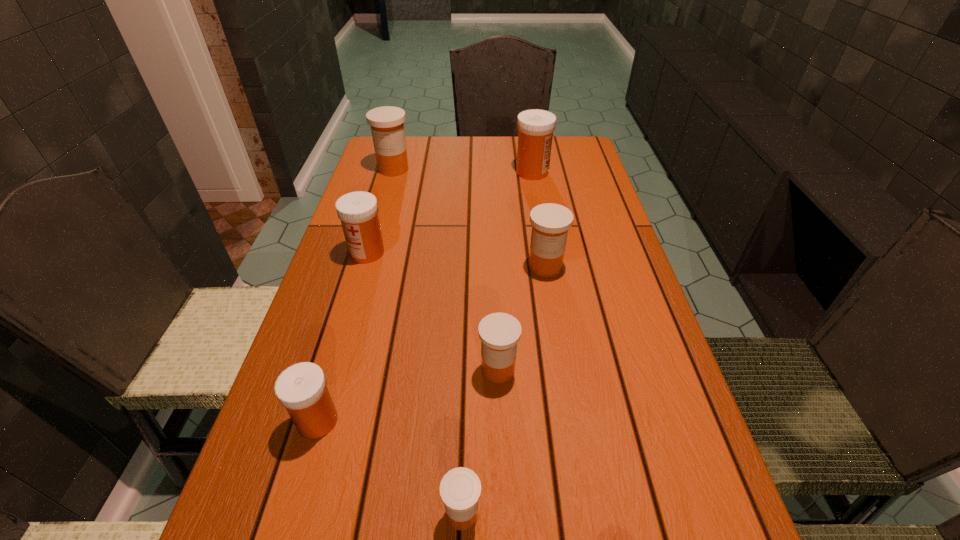
Identify which white medicine is located as the second nearest to the smallest white medicine. Please provide its 2D coordinates. Your answer should be formatted as a tuple, i.e. [(x, y)], where the tuple contains the x and y coordinates of a point satisfying the conditions above.

[(535, 127)]

Where is `the second closest orange medicine to the nearest orange medicine`? The height and width of the screenshot is (540, 960). the second closest orange medicine to the nearest orange medicine is located at coordinates (550, 222).

Identify the location of orange medicine that stands as the third closest to the second biggest white medicine. The image size is (960, 540). (499, 333).

This screenshot has width=960, height=540. Find the location of `free spot that satisfies the following two spatial constraints: 1. on the label of the rightmost orange medicine; 2. on the label of the smallest orange medicine`. free spot that satisfies the following two spatial constraints: 1. on the label of the rightmost orange medicine; 2. on the label of the smallest orange medicine is located at coordinates (586, 513).

The image size is (960, 540). I want to click on free space in the image that satisfies the following two spatial constraints: 1. on the label of the rightmost white medicine; 2. on the left side of the leftmost orange medicine, so click(x=393, y=172).